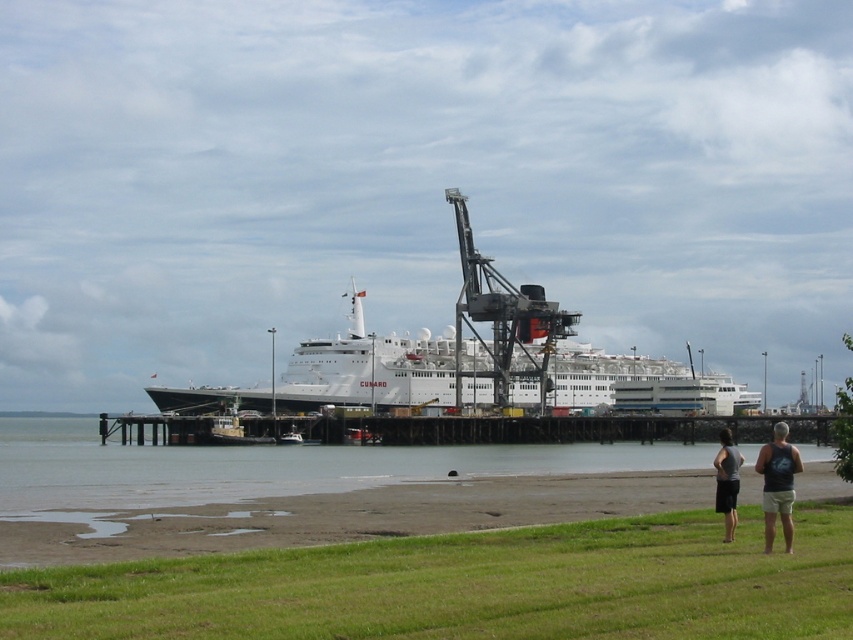
You are standing at the grassy area near the cruise ship and want to reach the point marked at coordinates point [775,426]. Given that you can walk at a speed of 3 feet per second, how many seconds will it take you to reach that point?

The distance between you and the point [775,426] is 484.49 feet. Dividing the distance by your walking speed of 3 feet per second gives 484.49 divided by 3 equals approximately 161.5 seconds. Therefore, it will take approximately 161.5 seconds to reach the point.

You are a photographer positioned on the grassy area and want to capture both the dark gray tank top at lower right and the dark gray fabric shorts at lower right in a single photo. However, you can only focus on one subject at a time. Which subject should you focus on to ensure the other remains in the background?

You should focus on the dark gray tank top at lower right because it is in front of the dark gray fabric shorts at lower right, so focusing on the closer subject will keep the background subject in focus.

You are a delivery person with a cart that is 1.2 meters wide. You need to transport items from the grassy area to the wooden dock at center. Is there enough space to pass by the dark gray tank top at lower right without hitting the cart?

The wooden dock at center might be wider than dark gray tank top at lower right, but since the cart is 1.2 meters wide, it is uncertain if there is enough space to pass safely. The width comparison between the dock and the tank top does not directly indicate the available pathway width.